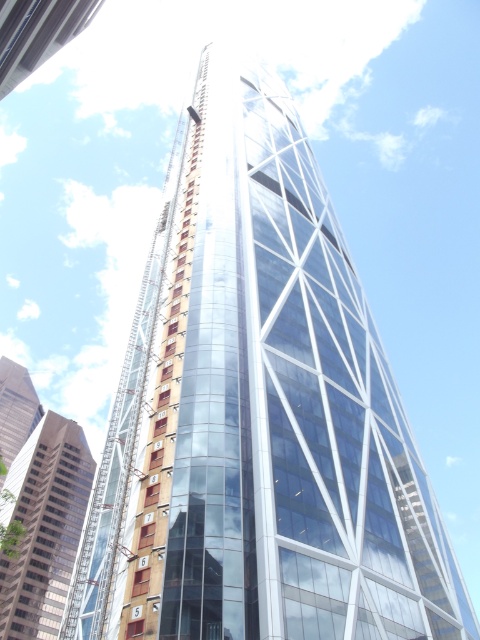
Question: Does glassy reflective building at lower left appear under transparent glass tower at upper left?

Choices:
 (A) yes
 (B) no

Answer: (A)

Question: Which point is closer to the camera?

Choices:
 (A) transparent glass tower at upper left
 (B) glassy reflective building at lower left

Answer: (A)

Question: Among these points, which one is farthest from the camera?

Choices:
 (A) (41, 40)
 (B) (14, 620)

Answer: (B)

Question: Is glassy reflective building at lower left positioned behind transparent glass tower at upper left?

Choices:
 (A) no
 (B) yes

Answer: (B)

Question: Considering the relative positions of glassy reflective building at lower left and transparent glass tower at upper left in the image provided, where is glassy reflective building at lower left located with respect to transparent glass tower at upper left?

Choices:
 (A) left
 (B) right

Answer: (A)